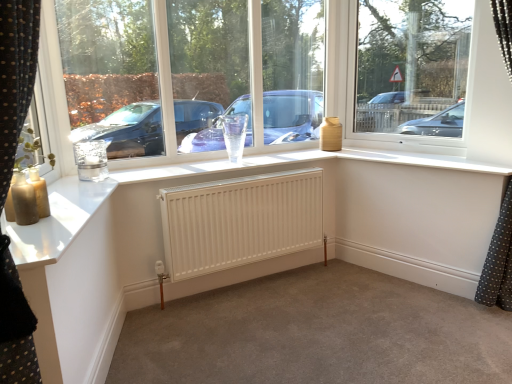
The width and height of the screenshot is (512, 384). Describe the element at coordinates (411, 69) in the screenshot. I see `transparent glass window at upper right` at that location.

Find the location of a particular element. The image size is (512, 384). white matte radiator at center is located at coordinates (316, 333).

Describe the element at coordinates (316, 333) in the screenshot. Image resolution: width=512 pixels, height=384 pixels. I see `white matte radiator at center` at that location.

You are a GUI agent. You are given a task and a screenshot of the screen. Output one action in this format:
    pyautogui.click(x=<x>, y=<y>)
    Task: Click on the white matte radiator at center
    
    Given the screenshot: What is the action you would take?
    pyautogui.click(x=240, y=221)

Locate an element on the screen. The image size is (512, 384). transparent glass window at upper right is located at coordinates (411, 69).

Between white matte radiator at center and white matte radiator at center, which one has larger width?

With larger width is white matte radiator at center.

Is white matte radiator at center far from white matte radiator at center?

They are positioned close to each other.

Which of these two, white matte radiator at center or white matte radiator at center, stands taller?

With more height is white matte radiator at center.

Is white matte radiator at center located within white matte radiator at center?

That's incorrect, white matte radiator at center is not inside white matte radiator at center.

From a real-world perspective, is white matte radiator at center on top of white matte radiator at center?

Yes, from a real-world perspective, white matte radiator at center is above white matte radiator at center.

Which is more to the left, white matte radiator at center or white matte radiator at center?

white matte radiator at center is more to the left.

From the image's perspective, is white matte radiator at center under white matte radiator at center?

No, from the image's perspective, white matte radiator at center is not below white matte radiator at center.

Locate an element on the screen. Image resolution: width=512 pixels, height=384 pixels. radiator below the white matte radiator at center (from the image's perspective) is located at coordinates (240, 221).

Is white matte radiator at center next to white matte radiator at center and touching it?

No.

From a real-world perspective, is white matte radiator at center positioned under white matte radiator at center based on gravity?

Incorrect, from a real-world perspective, white matte radiator at center is higher than white matte radiator at center.

Would you say white matte radiator at center is inside or outside white matte radiator at center?

white matte radiator at center cannot be found inside white matte radiator at center.

Is transparent glass vase at upper center positioned with its back to white matte radiator at center?

No.

Which object is closer to the camera taking this photo, transparent glass vase at upper center or white matte radiator at center?

white matte radiator at center is more forward.

Does transparent glass vase at upper center have a larger size compared to white matte radiator at center?

No.

Identify the location of window above the white matte radiator at center (from the image's perspective). (256, 71).

Is transparent glass vase at upper center with white matte radiator at center?

transparent glass vase at upper center and white matte radiator at center are not in contact.

From the image's perspective, is transparent glass vase at upper center on white matte radiator at center?

Correct, transparent glass vase at upper center appears higher than white matte radiator at center in the image.

Which object is closer to the camera taking this photo, transparent glass vase at upper center or white matte radiator at center?

transparent glass vase at upper center is more forward.

Consider the image. Is white matte radiator at center at the back of transparent glass vase at upper center?

No, transparent glass vase at upper center is not facing the opposite direction of white matte radiator at center.

Is transparent glass window at upper right spatially inside white matte radiator at center, or outside of it?

transparent glass window at upper right is located beyond the bounds of white matte radiator at center.

Find the location of a particular element. The image size is (512, 384). window sill located underneath the transparent glass window at upper right (from a real-world perspective) is located at coordinates (304, 161).

From the picture: Is transparent glass window at upper right aimed at white matte radiator at center?

Yes.

The image size is (512, 384). Identify the location of window sill lying behind the white matte radiator at center. (304, 161).

Is point (335, 359) positioned behind point (347, 153)?

No, (335, 359) is closer to viewer.

Considering the relative sizes of white matte radiator at center and white matte radiator at center in the image provided, is white matte radiator at center thinner than white matte radiator at center?

No.

Where is `radiator lying above the white matte radiator at center (from the image's perspective)`? radiator lying above the white matte radiator at center (from the image's perspective) is located at coordinates (240, 221).

Identify the location of window sill above the white matte radiator at center (from a real-world perspective). (304, 161).

Based on their spatial positions, is transparent glass window at upper right or white matte radiator at center further from white matte radiator at center?

The object further to white matte radiator at center is transparent glass window at upper right.

Based on their spatial positions, is white matte radiator at center or white matte radiator at center further from white matte radiator at center?

white matte radiator at center is positioned further to the anchor white matte radiator at center.

Based on their spatial positions, is white matte radiator at center or transparent glass window at upper right closer to transparent glass vase at upper center?

transparent glass window at upper right is positioned closer to the anchor transparent glass vase at upper center.

Looking at this image, based on their spatial positions, is white matte radiator at center or transparent glass vase at upper center closer to transparent glass window at upper right?

transparent glass vase at upper center.

Estimate the real-world distances between objects in this image. Which object is closer to white matte radiator at center, transparent glass window at upper right or transparent glass vase at upper center?

transparent glass vase at upper center is positioned closer to the anchor white matte radiator at center.

Consider the image. Which object lies nearer to the anchor point white matte radiator at center, white matte radiator at center or white matte radiator at center?

Among the two, white matte radiator at center is located nearer to white matte radiator at center.

Estimate the real-world distances between objects in this image. Which object is closer to white matte radiator at center, transparent glass window at upper right or white matte radiator at center?

The object closer to white matte radiator at center is white matte radiator at center.

When comparing their distances from white matte radiator at center, does transparent glass vase at upper center or transparent glass window at upper right seem further?

transparent glass window at upper right is positioned further to the anchor white matte radiator at center.

Identify the location of radiator located between transparent glass vase at upper center and transparent glass window at upper right in the left-right direction. Image resolution: width=512 pixels, height=384 pixels. (240, 221).

Locate an element on the screen. Image resolution: width=512 pixels, height=384 pixels. radiator situated between white matte radiator at center and transparent glass window at upper right from left to right is located at coordinates (240, 221).

You are a GUI agent. You are given a task and a screenshot of the screen. Output one action in this format:
    pyautogui.click(x=<x>, y=<y>)
    Task: Click on the window sill between transparent glass window at upper right and white matte radiator at center vertically
    The height and width of the screenshot is (384, 512).
    Given the screenshot: What is the action you would take?
    pyautogui.click(x=304, y=161)

The height and width of the screenshot is (384, 512). In order to click on window sill located between white matte radiator at center and white matte radiator at center in the depth direction in this screenshot , I will do click(304, 161).